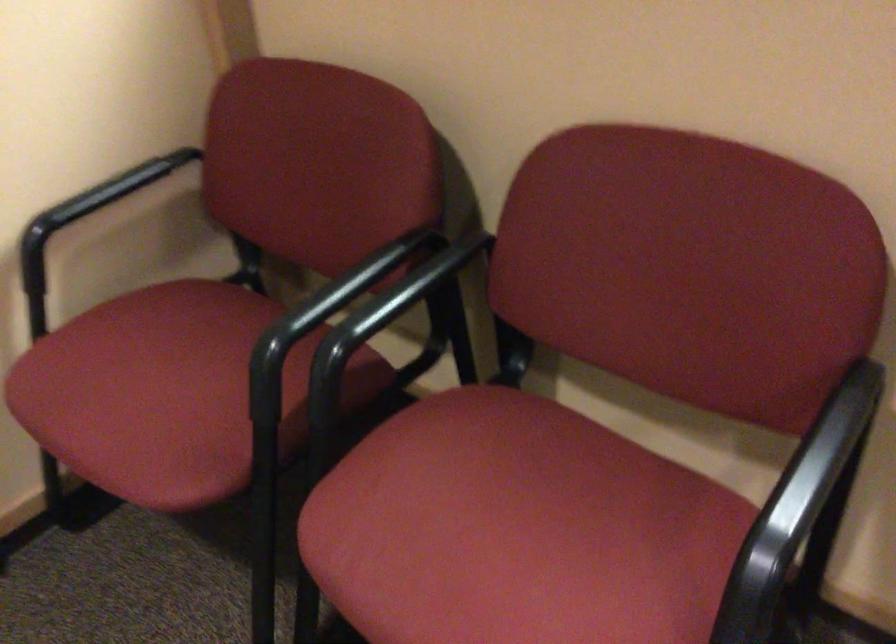
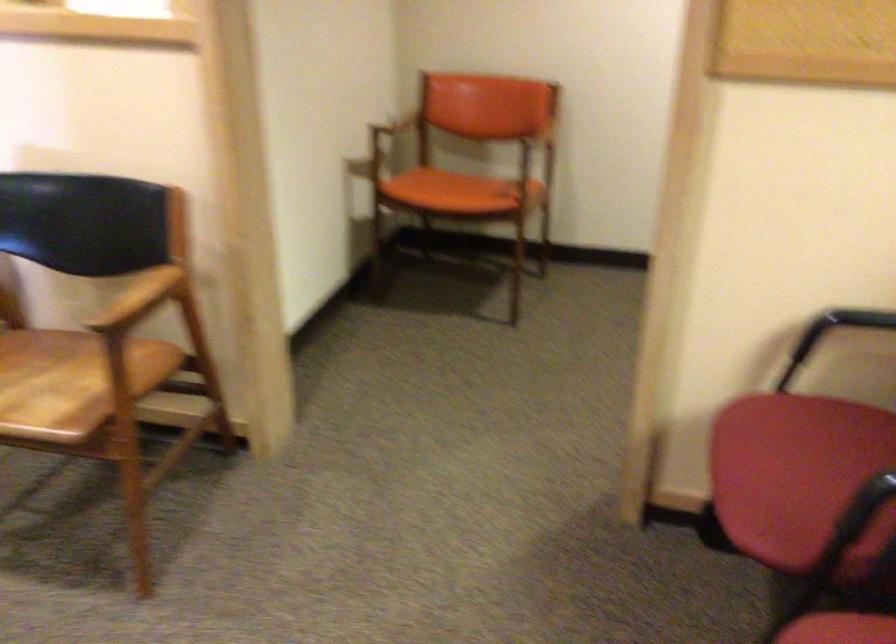
In the second image, find the point that corresponds to point 158,397 in the first image.

(798, 477)